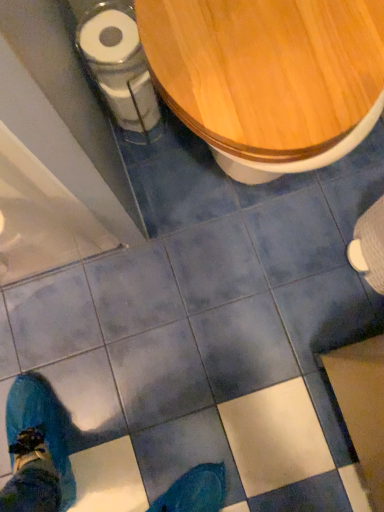
Locate an element on the screen. This screenshot has height=512, width=384. wooden at upper right is located at coordinates (269, 77).

Describe the element at coordinates (269, 77) in the screenshot. This screenshot has height=512, width=384. I see `wooden at upper right` at that location.

The height and width of the screenshot is (512, 384). I want to click on wooden at upper right, so click(x=269, y=77).